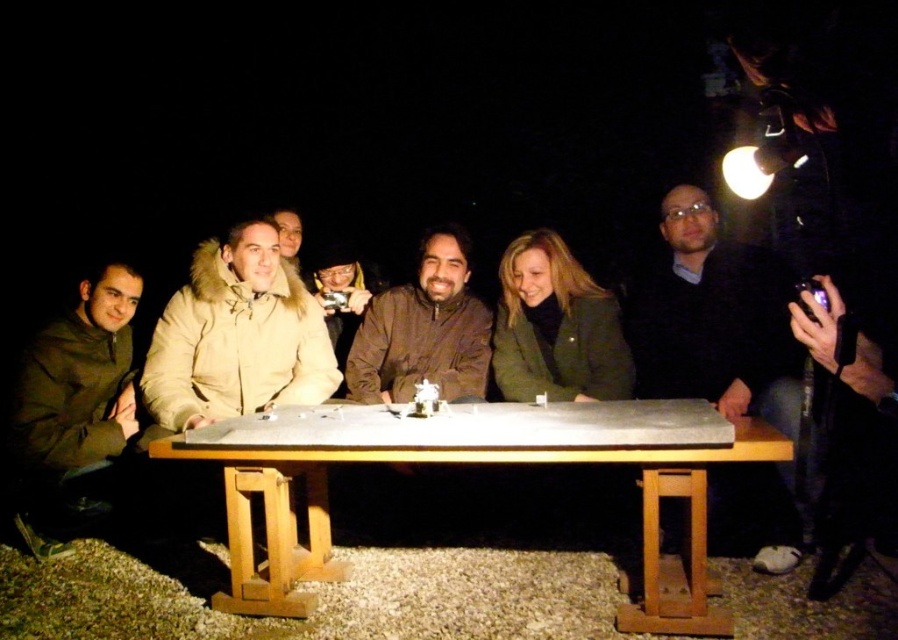
Can you confirm if dark blue sweater at center is wider than brown matte jacket at center?

No.

Which is more to the left, dark blue sweater at center or brown matte jacket at center?

Positioned to the left is brown matte jacket at center.

Does point (772, 339) come in front of point (461, 356)?

Yes, point (772, 339) is closer to viewer.

This screenshot has width=898, height=640. I want to click on dark blue sweater at center, so click(714, 320).

Is point (649, 532) positioned after point (430, 362)?

No, it is in front of (430, 362).

What do you see at coordinates (469, 464) in the screenshot? Image resolution: width=898 pixels, height=640 pixels. I see `smooth stone table at center` at bounding box center [469, 464].

Is point (703, 589) closer to camera compared to point (453, 371)?

Yes, it is in front of point (453, 371).

I want to click on smooth stone table at center, so click(x=469, y=464).

Is dark blue sweater at center closer to camera compared to green matte jacket at center?

That is True.

Can you confirm if dark blue sweater at center is taller than green matte jacket at center?

Correct, dark blue sweater at center is much taller as green matte jacket at center.

Does point (789, 493) lie in front of point (577, 401)?

Yes.

You are a GUI agent. You are given a task and a screenshot of the screen. Output one action in this format:
    pyautogui.click(x=<x>, y=<y>)
    Task: Click on the dark blue sweater at center
    
    Given the screenshot: What is the action you would take?
    pyautogui.click(x=714, y=320)